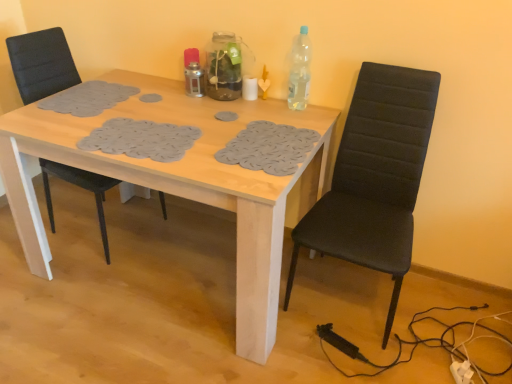
Locate an element on the screen. The width and height of the screenshot is (512, 384). free spot above light wood table at center (from a real-world perspective) is located at coordinates pos(178,119).